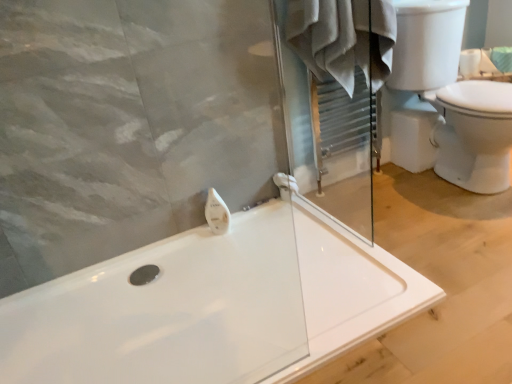
Find the location of a particular element. The image size is (512, 384). vacant space that is to the left of white plastic towel bar at center is located at coordinates (263, 212).